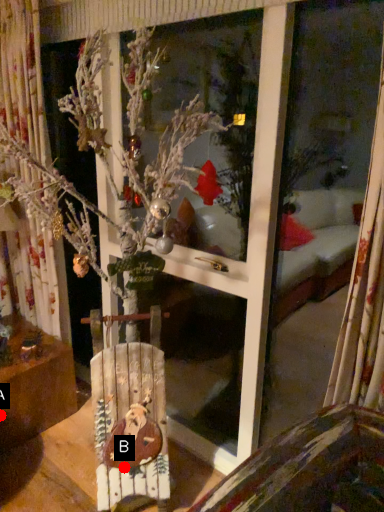
Question: Two points are circled on the image, labeled by A and B beside each circle. Which of the following is the closest to the observer?

Choices:
 (A) A is closer
 (B) B is closer

Answer: (B)